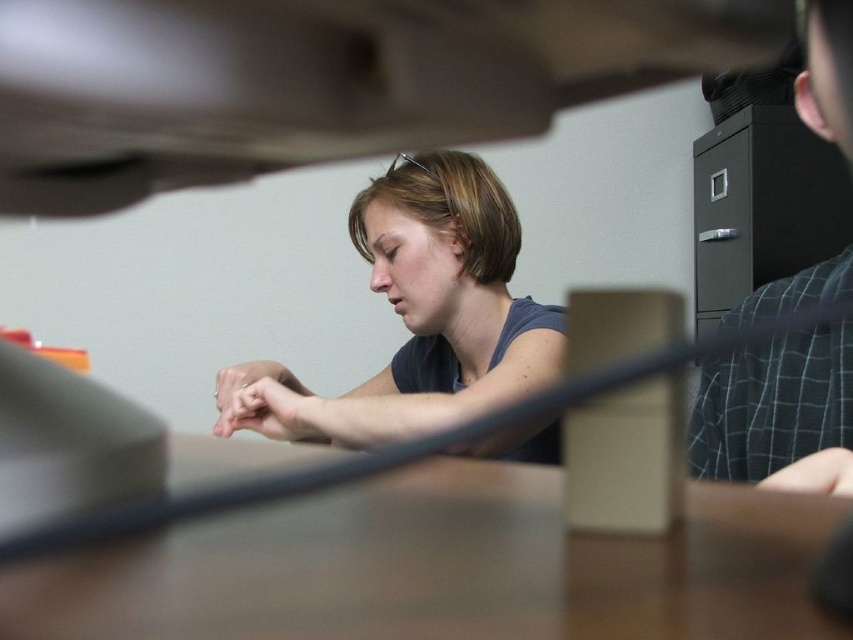
You are an observer in the office scene. You notice a plaid shirt at right and a matte black hand at center. Which object is closer to you?

The plaid shirt at right is closer to you because it is in front of the matte black hand at center.

You are standing in the office scene and want to move from the point at coordinates (496, 624) to the point at coordinates (222, 406). Which direction should you move relative to your current position?

You should move backward because point (496, 624) is in front of point (222, 406), so moving backward will take you towards the latter point.

You are an observer in the office scene. You notice the plaid shirt at right and the matte black hand at center. Which object occupies a higher vertical position in the image?

The plaid shirt at right is taller than the matte black hand at center, so the plaid shirt at right is higher vertically.